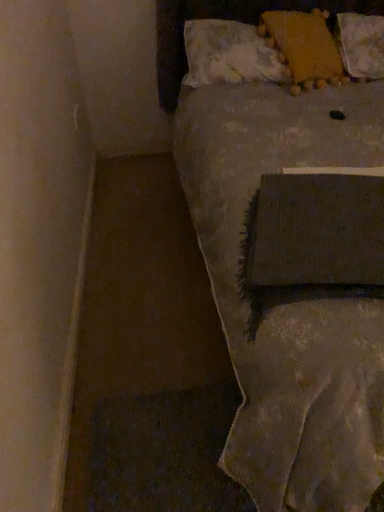
What do you see at coordinates (281, 288) in the screenshot? The height and width of the screenshot is (512, 384). I see `textured gray blanket at center` at bounding box center [281, 288].

The height and width of the screenshot is (512, 384). Describe the element at coordinates (304, 44) in the screenshot. I see `yellow fabric pillow at upper right, which appears as the 2th pillow when viewed from the right` at that location.

Find the location of a particular element. The height and width of the screenshot is (512, 384). yellow fabric pillow at upper right, positioned as the 3th pillow in right-to-left order is located at coordinates (230, 54).

What are the coordinates of `textured gray blanket at center` in the screenshot? It's located at (281, 288).

Is yellow fabric pillow at upper right, the first pillow from the left, shorter than yellow fabric pillow at upper right, which appears as the 2th pillow when viewed from the right?

Yes.

Is yellow fabric pillow at upper right, positioned as the 3th pillow in right-to-left order, surrounding yellow fabric pillow at upper right, which appears as the 2th pillow when viewed from the right?

Yes, yellow fabric pillow at upper right, which appears as the 2th pillow when viewed from the right, is inside yellow fabric pillow at upper right, positioned as the 3th pillow in right-to-left order.

I want to click on pillow positioned vertically above the yellow fabric pillow at upper right, the first pillow from the left (from a real-world perspective), so click(304, 44).

Is yellow fabric pillow at upper right, the first pillow from the left, oriented towards yellow fabric pillow at upper right, which appears as the 2th pillow when viewed from the right?

Yes, yellow fabric pillow at upper right, the first pillow from the left, is turned towards yellow fabric pillow at upper right, which appears as the 2th pillow when viewed from the right.

Is textured gray blanket at center wider than yellow fabric pillow at upper right, the 2th pillow from the left?

Yes, textured gray blanket at center is wider than yellow fabric pillow at upper right, the 2th pillow from the left.

In the scene shown: Considering the relative positions of textured gray blanket at center and yellow fabric pillow at upper right, the 2th pillow from the left, in the image provided, is textured gray blanket at center to the left of yellow fabric pillow at upper right, the 2th pillow from the left, from the viewer's perspective?

No.

Looking at this image, does yellow fabric pillow at upper right, the first pillow from the left, touch textured gray blanket at center?

No, yellow fabric pillow at upper right, the first pillow from the left, is not touching textured gray blanket at center.

Considering the relative sizes of yellow fabric pillow at upper right, the first pillow from the left, and textured gray blanket at center in the image provided, is yellow fabric pillow at upper right, the first pillow from the left, wider than textured gray blanket at center?

No, yellow fabric pillow at upper right, the first pillow from the left, is not wider than textured gray blanket at center.

The image size is (384, 512). I want to click on the 1st pillow above the textured gray blanket at center (from the image's perspective), so click(x=230, y=54).

Considering the relative sizes of yellow fabric pillow at upper right, the first pillow from the left, and textured gray blanket at center in the image provided, is yellow fabric pillow at upper right, the first pillow from the left, bigger than textured gray blanket at center?

Actually, yellow fabric pillow at upper right, the first pillow from the left, might be smaller than textured gray blanket at center.

From the image's perspective, is fluffy yellow pillow at upper right, acting as the first pillow starting from the right, on yellow fabric pillow at upper right, the 2th pillow from the left?

Correct, fluffy yellow pillow at upper right, acting as the first pillow starting from the right, appears higher than yellow fabric pillow at upper right, the 2th pillow from the left, in the image.

Can you confirm if fluffy yellow pillow at upper right, acting as the first pillow starting from the right, is thinner than yellow fabric pillow at upper right, the 2th pillow from the left?

In fact, fluffy yellow pillow at upper right, acting as the first pillow starting from the right, might be wider than yellow fabric pillow at upper right, the 2th pillow from the left.

Between point (341, 58) and point (268, 19), which one is positioned behind?

Point (341, 58)

Is textured gray blanket at center beside fluffy yellow pillow at upper right, the 3th pillow when ordered from left to right?

textured gray blanket at center and fluffy yellow pillow at upper right, the 3th pillow when ordered from left to right, are clearly separated.

Is textured gray blanket at center turned away from fluffy yellow pillow at upper right, the 3th pillow when ordered from left to right?

Yes, fluffy yellow pillow at upper right, the 3th pillow when ordered from left to right, is at the back of textured gray blanket at center.

Is the surface of yellow fabric pillow at upper right, positioned as the 3th pillow in right-to-left order, in direct contact with fluffy yellow pillow at upper right, the 3th pillow when ordered from left to right?

No, yellow fabric pillow at upper right, positioned as the 3th pillow in right-to-left order, is not making contact with fluffy yellow pillow at upper right, the 3th pillow when ordered from left to right.

Who is taller, yellow fabric pillow at upper right, the first pillow from the left, or fluffy yellow pillow at upper right, acting as the first pillow starting from the right?

Standing taller between the two is fluffy yellow pillow at upper right, acting as the first pillow starting from the right.

From the image's perspective, is yellow fabric pillow at upper right, the first pillow from the left, on top of fluffy yellow pillow at upper right, the 3th pillow when ordered from left to right?

No, from the image's perspective, yellow fabric pillow at upper right, the first pillow from the left, is not over fluffy yellow pillow at upper right, the 3th pillow when ordered from left to right.

Can you confirm if yellow fabric pillow at upper right, the first pillow from the left, is smaller than fluffy yellow pillow at upper right, acting as the first pillow starting from the right?

No, yellow fabric pillow at upper right, the first pillow from the left, is not smaller than fluffy yellow pillow at upper right, acting as the first pillow starting from the right.

The image size is (384, 512). There is a fluffy yellow pillow at upper right, acting as the first pillow starting from the right. Find the location of `the 1st pillow below it (from the image's perspective)`. the 1st pillow below it (from the image's perspective) is located at coordinates (304, 44).

Is yellow fabric pillow at upper right, the 2th pillow from the left, not close to fluffy yellow pillow at upper right, acting as the first pillow starting from the right?

That's not correct — yellow fabric pillow at upper right, the 2th pillow from the left, is a little close to fluffy yellow pillow at upper right, acting as the first pillow starting from the right.

Does yellow fabric pillow at upper right, the 2th pillow from the left, turn towards fluffy yellow pillow at upper right, the 3th pillow when ordered from left to right?

No, yellow fabric pillow at upper right, the 2th pillow from the left, is not facing towards fluffy yellow pillow at upper right, the 3th pillow when ordered from left to right.

There is a yellow fabric pillow at upper right, the first pillow from the left. Where is `pillow above it (from a real-world perspective)`? pillow above it (from a real-world perspective) is located at coordinates (304, 44).

Locate an element on the screen. This screenshot has width=384, height=512. bed below the yellow fabric pillow at upper right, the 2th pillow from the left (from the image's perspective) is located at coordinates (281, 288).

Consider the image. Looking at the image, which one is located further to yellow fabric pillow at upper right, which appears as the 2th pillow when viewed from the right, yellow fabric pillow at upper right, the first pillow from the left, or fluffy yellow pillow at upper right, the 3th pillow when ordered from left to right?

yellow fabric pillow at upper right, the first pillow from the left, is positioned further to the anchor yellow fabric pillow at upper right, which appears as the 2th pillow when viewed from the right.

When comparing their distances from fluffy yellow pillow at upper right, the 3th pillow when ordered from left to right, does yellow fabric pillow at upper right, positioned as the 3th pillow in right-to-left order, or textured gray blanket at center seem closer?

Based on the image, yellow fabric pillow at upper right, positioned as the 3th pillow in right-to-left order, appears to be nearer to fluffy yellow pillow at upper right, the 3th pillow when ordered from left to right.

Estimate the real-world distances between objects in this image. Which object is further from yellow fabric pillow at upper right, the 2th pillow from the left, fluffy yellow pillow at upper right, the 3th pillow when ordered from left to right, or textured gray blanket at center?

textured gray blanket at center is further to yellow fabric pillow at upper right, the 2th pillow from the left.

From the picture: Considering their positions, is textured gray blanket at center positioned closer to yellow fabric pillow at upper right, positioned as the 3th pillow in right-to-left order, than fluffy yellow pillow at upper right, the 3th pillow when ordered from left to right?

textured gray blanket at center lies closer to yellow fabric pillow at upper right, positioned as the 3th pillow in right-to-left order, than the other object.

From the image, which object appears to be nearer to yellow fabric pillow at upper right, positioned as the 3th pillow in right-to-left order, fluffy yellow pillow at upper right, acting as the first pillow starting from the right, or textured gray blanket at center?

The object closer to yellow fabric pillow at upper right, positioned as the 3th pillow in right-to-left order, is textured gray blanket at center.

Based on their spatial positions, is yellow fabric pillow at upper right, which appears as the 2th pillow when viewed from the right, or yellow fabric pillow at upper right, the first pillow from the left, closer to fluffy yellow pillow at upper right, the 3th pillow when ordered from left to right?

The object closer to fluffy yellow pillow at upper right, the 3th pillow when ordered from left to right, is yellow fabric pillow at upper right, which appears as the 2th pillow when viewed from the right.

From the image, which object appears to be farther from textured gray blanket at center, fluffy yellow pillow at upper right, acting as the first pillow starting from the right, or yellow fabric pillow at upper right, which appears as the 2th pillow when viewed from the right?

Based on the image, fluffy yellow pillow at upper right, acting as the first pillow starting from the right, appears to be further to textured gray blanket at center.

Considering their positions, is yellow fabric pillow at upper right, which appears as the 2th pillow when viewed from the right, positioned closer to textured gray blanket at center than fluffy yellow pillow at upper right, acting as the first pillow starting from the right?

A: The object closer to textured gray blanket at center is yellow fabric pillow at upper right, which appears as the 2th pillow when viewed from the right.

Locate an element on the screen. pillow between textured gray blanket at center and yellow fabric pillow at upper right, positioned as the 3th pillow in right-to-left order, along the z-axis is located at coordinates (304, 44).

Where is `pillow located between yellow fabric pillow at upper right, positioned as the 3th pillow in right-to-left order, and fluffy yellow pillow at upper right, the 3th pillow when ordered from left to right, in the left-right direction`? The image size is (384, 512). pillow located between yellow fabric pillow at upper right, positioned as the 3th pillow in right-to-left order, and fluffy yellow pillow at upper right, the 3th pillow when ordered from left to right, in the left-right direction is located at coordinates (304, 44).